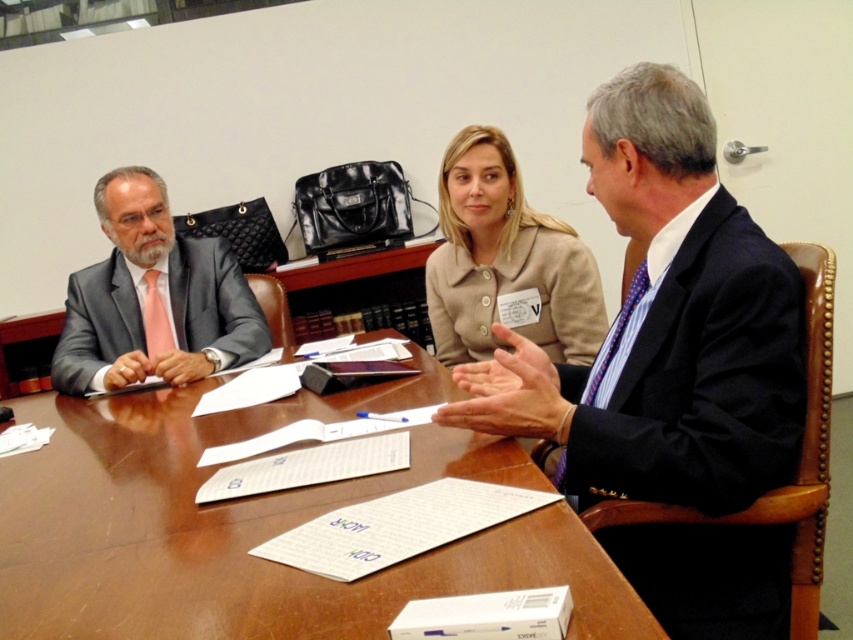
You are a guest entering the meeting room and need to sit down. The wooden table at center is in front of you. Can you sit on the navy blue suit at right to reach the table?

The wooden table at center is not as tall as navy blue suit at right. Therefore, sitting on the navy blue suit at right would make it difficult to comfortably reach the table since the suit is taller than the table.

You are organizing a photo shoot and need to arrange two outfits for a catalog. The outfits are the matte gray suit at left and the beige fabric jacket at center. Based on their sizes, which outfit requires more space to display properly?

The matte gray suit at left requires more space to display properly since its width surpasses that of the beige fabric jacket at center.